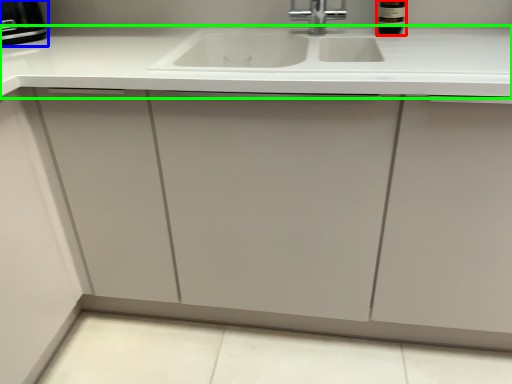
Question: Which object is the farthest from wine bottle (highlighted by a red box)? Choose among these: appliance (highlighted by a blue box) or countertop (highlighted by a green box).

Choices:
 (A) appliance
 (B) countertop

Answer: (A)